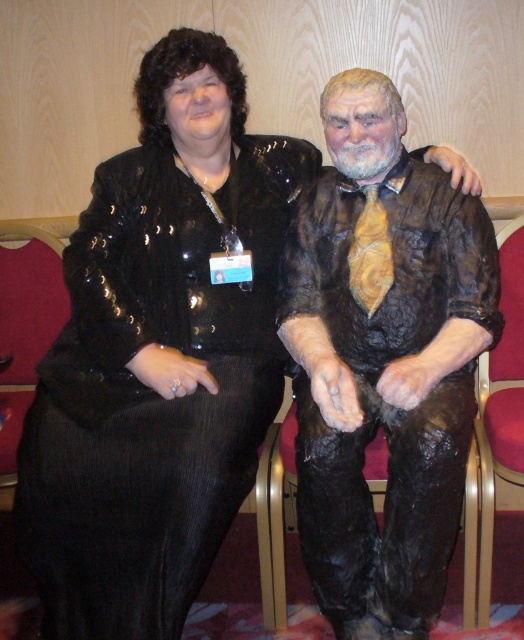
Question: Which point is closer to the camera taking this photo?

Choices:
 (A) (431, 611)
 (B) (304, 147)
 (C) (511, 368)

Answer: (A)

Question: Does black sequined dress at center appear over brown textured statue at center?

Choices:
 (A) yes
 (B) no

Answer: (B)

Question: Is black sequined dress at center positioned behind brown textured statue at center?

Choices:
 (A) no
 (B) yes

Answer: (A)

Question: Is brown textured statue at center below metallic gold armchair at right?

Choices:
 (A) yes
 (B) no

Answer: (B)

Question: Estimate the real-world distances between objects in this image. Which object is closer to the brown textured statue at center?

Choices:
 (A) metallic gold armchair at right
 (B) black sequined dress at center

Answer: (B)

Question: Which point is farther to the camera?

Choices:
 (A) metallic gold armchair at right
 (B) brown textured statue at center
 (C) black sequined dress at center

Answer: (A)